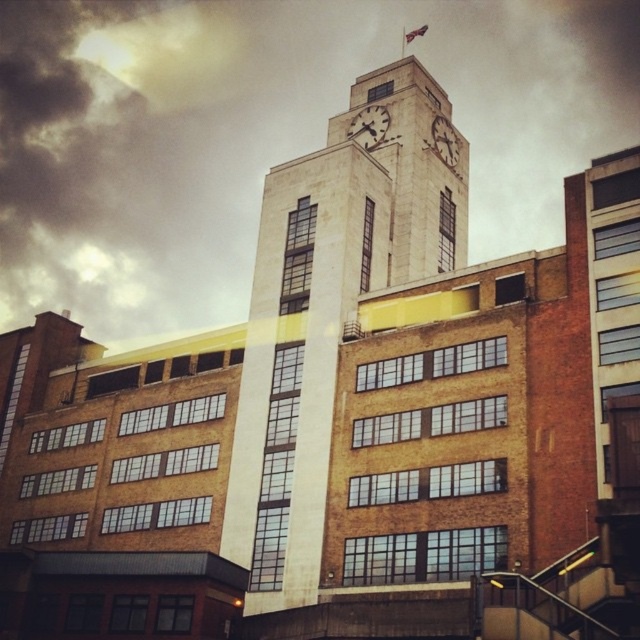
Question: Which object is positioned closest to the beige stone clock tower at center?

Choices:
 (A) metallic clock face at upper center
 (B) white stone clock at upper center
 (C) cloudy sky at upper center

Answer: (A)

Question: Is the position of cloudy sky at upper center less distant than that of metallic clock face at upper center?

Choices:
 (A) yes
 (B) no

Answer: (B)

Question: Which point is closer to the camera?

Choices:
 (A) cloudy sky at upper center
 (B) metallic clock face at upper center
 (C) beige stone clock tower at center
 (D) white stone clock at upper center

Answer: (C)

Question: Does beige stone clock tower at center appear on the left side of white stone clock at upper center?

Choices:
 (A) yes
 (B) no

Answer: (A)

Question: Which object appears farthest from the camera in this image?

Choices:
 (A) white stone clock at upper center
 (B) cloudy sky at upper center

Answer: (B)

Question: Can you confirm if beige stone clock tower at center is thinner than metallic clock face at upper center?

Choices:
 (A) yes
 (B) no

Answer: (B)